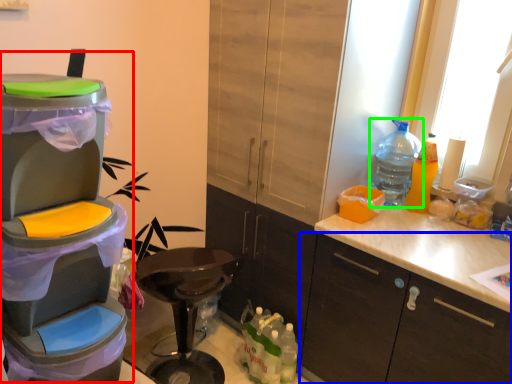
Question: Considering the real-world distances, which object is farthest from appliance (highlighted by a red box)? cabinetry (highlighted by a blue box) or bottle (highlighted by a green box)?

Choices:
 (A) cabinetry
 (B) bottle

Answer: (B)